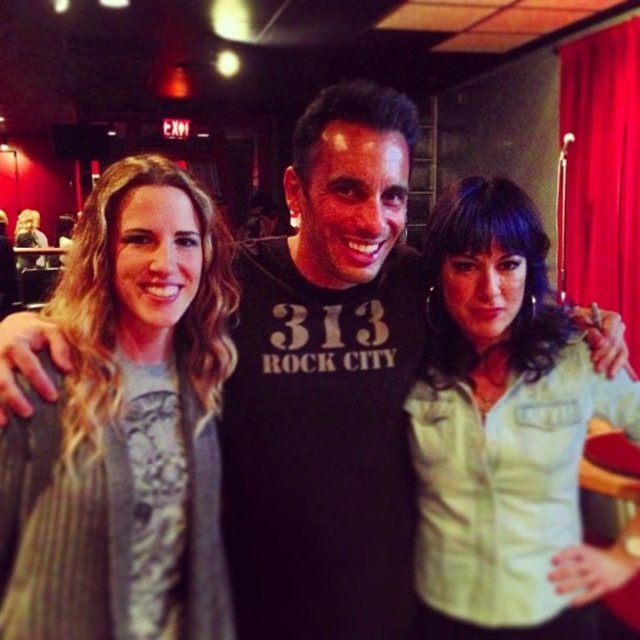
Looking at this image, is light green denim jacket at center to the left of red velvet curtain at upper right from the viewer's perspective?

Correct, you'll find light green denim jacket at center to the left of red velvet curtain at upper right.

Is light green denim jacket at center bigger than red velvet curtain at upper right?

Incorrect, light green denim jacket at center is not larger than red velvet curtain at upper right.

What are the coordinates of `light green denim jacket at center` in the screenshot? It's located at (506, 432).

This screenshot has width=640, height=640. Find the location of `light green denim jacket at center`. light green denim jacket at center is located at coordinates (506, 432).

Is red velvet curtain at upper right positioned before blonde hair at center?

That is True.

Does point (576, 83) come closer to viewer compared to point (38, 232)?

Yes, point (576, 83) is in front of point (38, 232).

Where is `red velvet curtain at upper right`? The image size is (640, 640). red velvet curtain at upper right is located at coordinates (602, 172).

The image size is (640, 640). What do you see at coordinates (506, 432) in the screenshot? I see `light green denim jacket at center` at bounding box center [506, 432].

Is light green denim jacket at center bigger than blonde hair at center?

Actually, light green denim jacket at center might be smaller than blonde hair at center.

Does point (570, 563) come closer to viewer compared to point (36, 225)?

Yes, it is in front of point (36, 225).

Where is `light green denim jacket at center`? This screenshot has height=640, width=640. light green denim jacket at center is located at coordinates (506, 432).